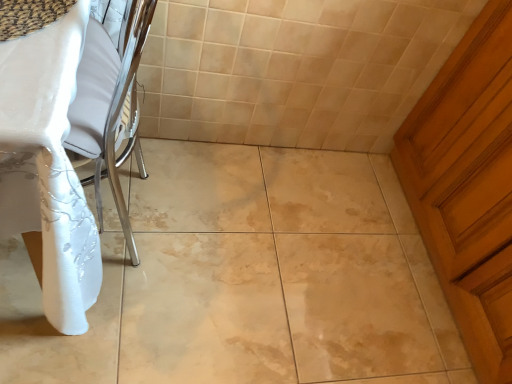
Image resolution: width=512 pixels, height=384 pixels. Describe the element at coordinates (48, 166) in the screenshot. I see `white glossy table at left` at that location.

What are the coordinates of `white glossy table at left` in the screenshot? It's located at (48, 166).

Identify the location of wooden door at right. This screenshot has width=512, height=384. (x=468, y=185).

Describe the element at coordinates (468, 185) in the screenshot. The image size is (512, 384). I see `wooden door at right` at that location.

This screenshot has height=384, width=512. In order to click on white glossy table at left in this screenshot , I will do [48, 166].

Considering the relative positions of wooden door at right and white glossy table at left in the image provided, is wooden door at right to the left or to the right of white glossy table at left?

Based on their positions, wooden door at right is located to the right of white glossy table at left.

In the image, is wooden door at right positioned in front of or behind white glossy table at left?

Clearly, wooden door at right is behind white glossy table at left.

Between point (496, 300) and point (10, 190), which one is positioned behind?

The point (496, 300) is farther from the camera.

From the image's perspective, is wooden door at right on white glossy table at left?

Incorrect, from the image's perspective, wooden door at right is lower than white glossy table at left.

From a real-world perspective, is wooden door at right above or below white glossy table at left?

In terms of real-world spatial position, wooden door at right is below white glossy table at left.

Does wooden door at right have a lesser width compared to white glossy table at left?

Correct, the width of wooden door at right is less than that of white glossy table at left.

Is wooden door at right taller than white glossy table at left?

In fact, wooden door at right may be shorter than white glossy table at left.

Who is bigger, wooden door at right or white glossy table at left?

wooden door at right.

From the picture: Is wooden door at right spatially inside white glossy table at left, or outside of it?

wooden door at right is not enclosed by white glossy table at left.

Is wooden door at right beside white glossy table at left?

No, wooden door at right is not beside white glossy table at left.

Is white glossy table at left at the back of wooden door at right?

No, white glossy table at left is not at the back of wooden door at right.

Based on the photo, how many degrees apart are the facing directions of wooden door at right and white glossy table at left?

The angle between the facing direction of wooden door at right and the facing direction of white glossy table at left is 89.1 degrees.

You are a GUI agent. You are given a task and a screenshot of the screen. Output one action in this format:
    pyautogui.click(x=<x>, y=<y>)
    Task: Click on the table lying in front of the wooden door at right
    Image resolution: width=512 pixels, height=384 pixels.
    Given the screenshot: What is the action you would take?
    pyautogui.click(x=48, y=166)

Considering the positions of objects white glossy table at left and wooden door at right in the image provided, who is more to the left, white glossy table at left or wooden door at right?

white glossy table at left.

In the scene shown: Relative to wooden door at right, is white glossy table at left in front or behind?

Clearly, white glossy table at left is in front of wooden door at right.

Is point (57, 250) positioned after point (502, 56)?

No, it is not.

From the image's perspective, is white glossy table at left positioned above or below wooden door at right?

Based on their image positions, white glossy table at left is located above wooden door at right.

From a real-world perspective, is white glossy table at left beneath wooden door at right?

No, from a real-world perspective, white glossy table at left is not below wooden door at right.

From the picture: Considering the sizes of white glossy table at left and wooden door at right in the image, is white glossy table at left wider or thinner than wooden door at right?

In the image, white glossy table at left appears to be wider than wooden door at right.

Consider the image. From their relative heights in the image, would you say white glossy table at left is taller or shorter than wooden door at right?

In the image, white glossy table at left appears to be taller than wooden door at right.

Considering the relative sizes of white glossy table at left and wooden door at right in the image provided, is white glossy table at left smaller than wooden door at right?

Yes.

Is white glossy table at left located outside wooden door at right?

Absolutely, white glossy table at left is external to wooden door at right.

Would you say white glossy table at left is a long distance from wooden door at right?

That's right, there is a large distance between white glossy table at left and wooden door at right.

Is white glossy table at left oriented away from wooden door at right?

No.

Can you tell me how much white glossy table at left and wooden door at right differ in facing direction?

They differ by 89.1 degrees in their facing directions.

Image resolution: width=512 pixels, height=384 pixels. I want to click on table in front of the wooden door at right, so click(x=48, y=166).

At what (x,y) coordinates should I click in order to perform the action: click on table that appears in front of the wooden door at right. Please return your answer as a coordinate pair (x, y). This screenshot has height=384, width=512. Looking at the image, I should click on (48, 166).

You are a GUI agent. You are given a task and a screenshot of the screen. Output one action in this format:
    pyautogui.click(x=<x>, y=<y>)
    Task: Click on the table lying on the left of wooden door at right
    The height and width of the screenshot is (384, 512).
    Given the screenshot: What is the action you would take?
    pyautogui.click(x=48, y=166)